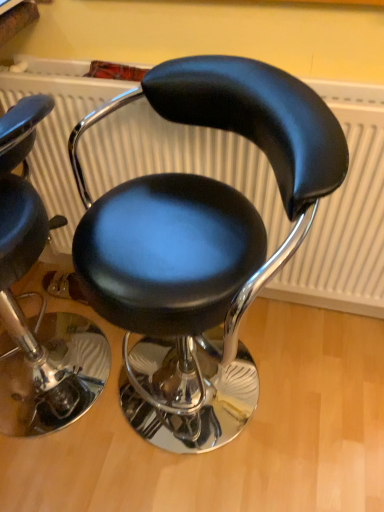
Question: From a real-world perspective, is black leather stool at center, which is counted as the first chair, starting from the right, physically located above or below black leather stool at center, positioned as the second chair in right-to-left order?

Choices:
 (A) below
 (B) above

Answer: (B)

Question: Considering the relative positions of black leather stool at center, which is counted as the first chair, starting from the right, and black leather stool at center, positioned as the second chair in right-to-left order, in the image provided, is black leather stool at center, which is counted as the first chair, starting from the right, to the left or to the right of black leather stool at center, positioned as the second chair in right-to-left order,?

Choices:
 (A) left
 (B) right

Answer: (B)

Question: Considering the positions of black leather stool at center, which is counted as the first chair, starting from the right, and black leather stool at center, positioned as the second chair in right-to-left order, in the image, is black leather stool at center, which is counted as the first chair, starting from the right, taller or shorter than black leather stool at center, positioned as the second chair in right-to-left order,?

Choices:
 (A) short
 (B) tall

Answer: (B)

Question: From their relative heights in the image, would you say black leather stool at center, positioned as the second chair in right-to-left order, is taller or shorter than black leather stool at center, marked as the second chair in a left-to-right arrangement?

Choices:
 (A) tall
 (B) short

Answer: (B)

Question: Is black leather stool at center, positioned as the second chair in right-to-left order, bigger or smaller than black leather stool at center, marked as the second chair in a left-to-right arrangement?

Choices:
 (A) big
 (B) small

Answer: (B)

Question: Would you say black leather stool at center, positioned as the second chair in right-to-left order, is inside or outside black leather stool at center, which is counted as the first chair, starting from the right?

Choices:
 (A) outside
 (B) inside

Answer: (A)

Question: In the image, is black leather stool at center, positioned as the second chair in right-to-left order, on the left side or the right side of black leather stool at center, marked as the second chair in a left-to-right arrangement?

Choices:
 (A) right
 (B) left

Answer: (B)